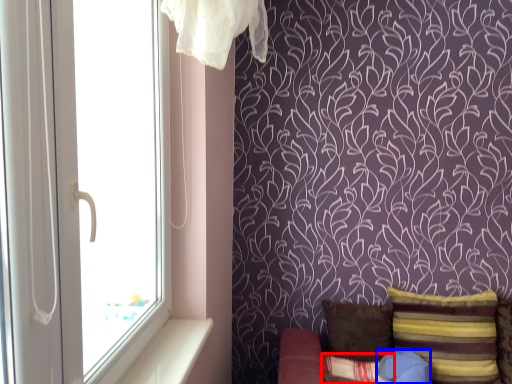
Question: Which of the following is the farthest to the observer, pillow (highlighted by a red box) or pillow (highlighted by a blue box)?

Choices:
 (A) pillow
 (B) pillow

Answer: (B)